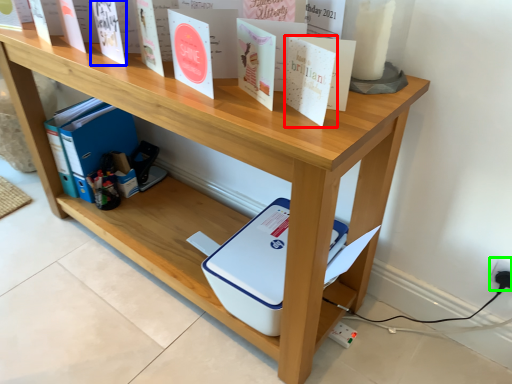
Question: Based on their relative distances, which object is farther from paperback book (highlighted by a red box)? Choose from paperback book (highlighted by a blue box) and electric outlet (highlighted by a green box).

Choices:
 (A) paperback book
 (B) electric outlet

Answer: (B)